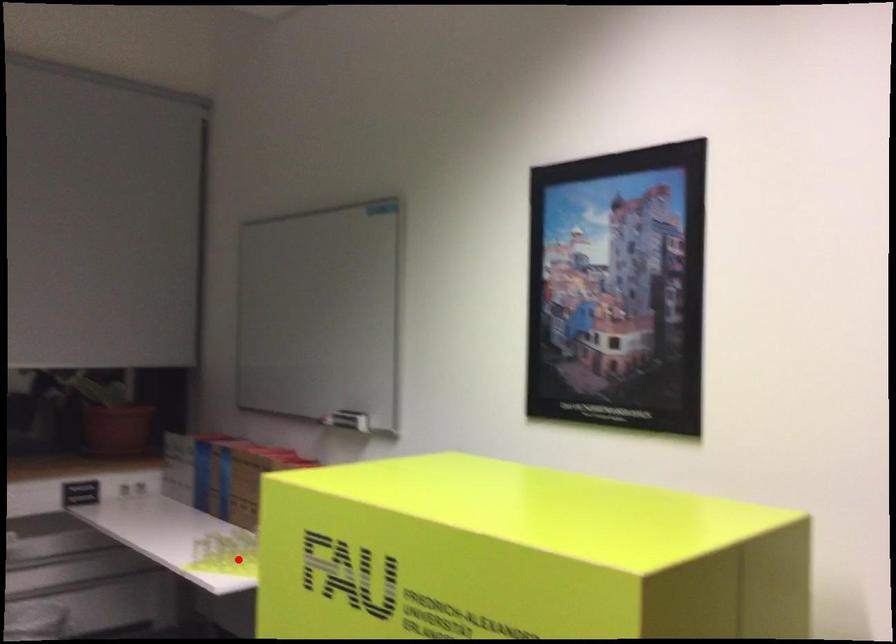
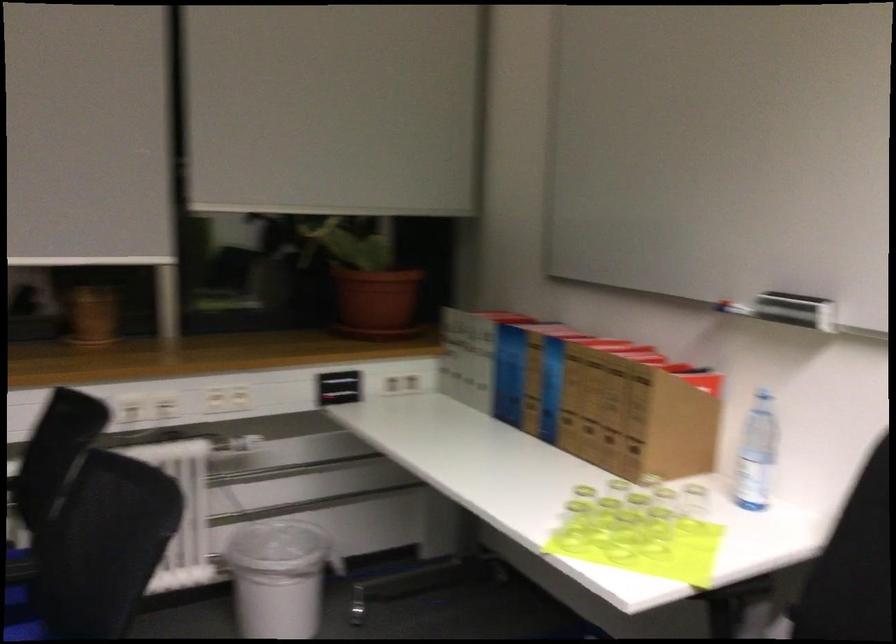
The point at the highlighted location is marked in the first image. Where is the corresponding point in the second image?

(623, 536)